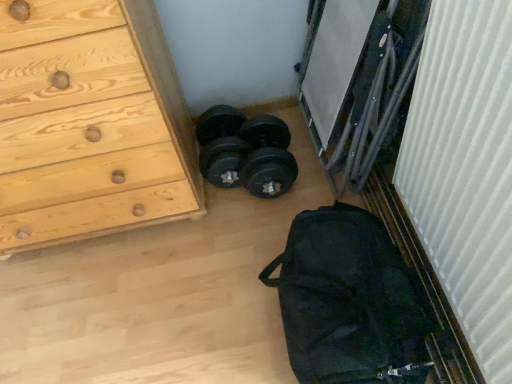
Where is `vacant area that lies between natural wood chest of drawers at left and black fabric bag at lower right`? vacant area that lies between natural wood chest of drawers at left and black fabric bag at lower right is located at coordinates (172, 285).